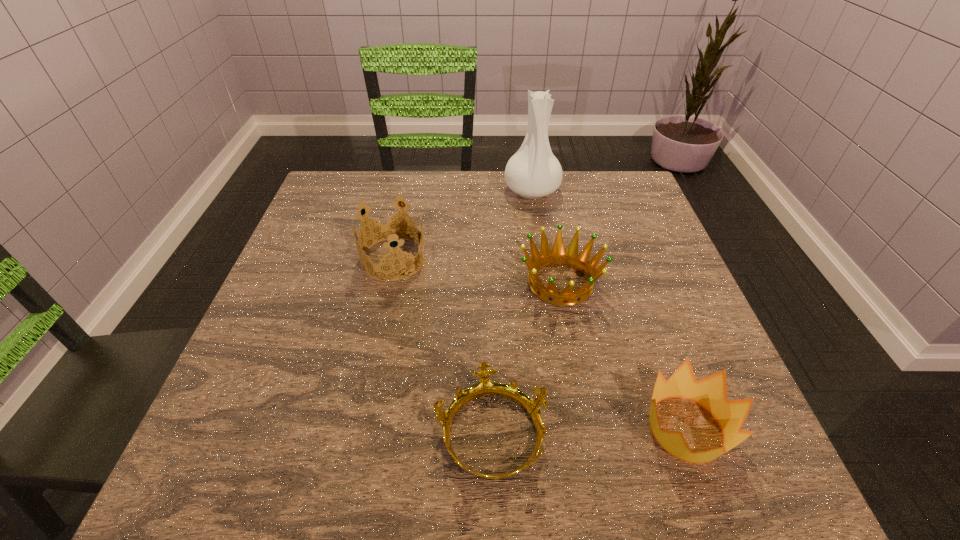
This screenshot has height=540, width=960. I want to click on unoccupied position between the vase and the tallest crown, so click(463, 225).

The width and height of the screenshot is (960, 540). I want to click on object that ranks as the second closest to the farthest object, so click(388, 231).

Locate an element on the screen. object that stands as the closest to the tallest crown is located at coordinates coord(558,256).

Where is `crown that is the third closest one to the tallest object`? crown that is the third closest one to the tallest object is located at coordinates (485, 387).

I want to click on the closest crown to the tallest crown, so click(558, 256).